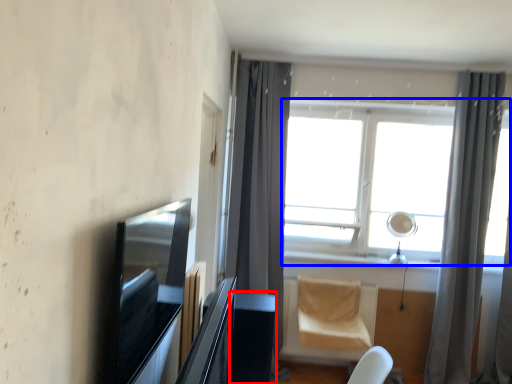
Question: Which object appears closest to the camera in this image, table (highlighted by a red box) or window (highlighted by a blue box)?

Choices:
 (A) table
 (B) window

Answer: (A)